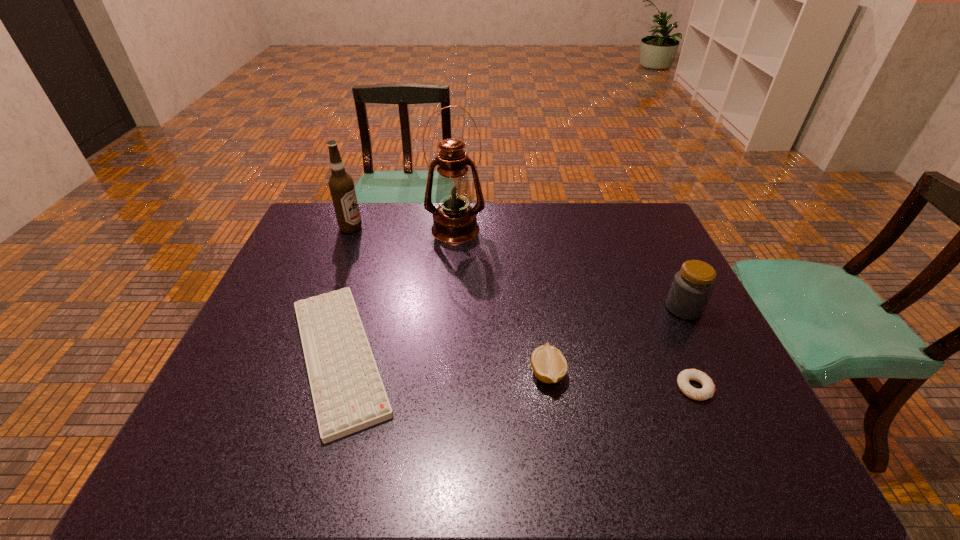
Where is `object that ranks as the closest to the lemon`? The height and width of the screenshot is (540, 960). object that ranks as the closest to the lemon is located at coordinates (708, 390).

I want to click on object that is the closest to the computer keyboard, so click(x=454, y=221).

You are a GUI agent. You are given a task and a screenshot of the screen. Output one action in this format:
    pyautogui.click(x=<x>, y=<y>)
    Task: Click on the free space that satisfies the following two spatial constraints: 1. on the back side of the fourth tallest object; 2. on the label of the fifth shortest object
    The image size is (960, 540).
    Given the screenshot: What is the action you would take?
    pyautogui.click(x=527, y=228)

Find the location of a particular element. The image size is (960, 540). vacant region that satisfies the following two spatial constraints: 1. on the front side of the doughnut; 2. on the right side of the oil lamp is located at coordinates (444, 388).

At what (x,y) coordinates should I click in order to perform the action: click on vacant space that satisfies the following two spatial constraints: 1. on the label of the oil lamp; 2. on the right side of the alcohol. Please return your answer as a coordinate pair (x, y). This screenshot has height=540, width=960. Looking at the image, I should click on (350, 229).

Identify the location of vacant space that satisfies the following two spatial constraints: 1. on the back side of the tallest object; 2. on the label of the alcohol. (455, 228).

You are a GUI agent. You are given a task and a screenshot of the screen. Output one action in this format:
    pyautogui.click(x=<x>, y=<y>)
    Task: Click on the free space that satisfies the following two spatial constraints: 1. on the label of the fifth shortest object; 2. on the right side of the tallest object
    The height and width of the screenshot is (540, 960).
    Given the screenshot: What is the action you would take?
    pyautogui.click(x=350, y=229)